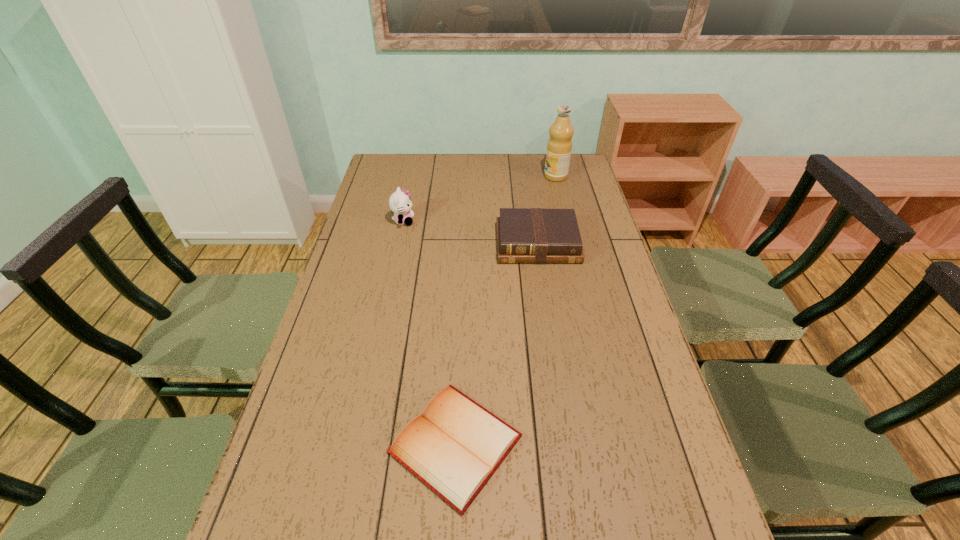
You are a GUI agent. You are given a task and a screenshot of the screen. Output one action in this format:
    pyautogui.click(x=<x>, y=<y>)
    Task: Click on the farthest object
    The height and width of the screenshot is (540, 960).
    Given the screenshot: What is the action you would take?
    pyautogui.click(x=559, y=146)

Locate an element on the screen. olive oil is located at coordinates (559, 146).

You are a GUI agent. You are given a task and a screenshot of the screen. Output one action in this format:
    pyautogui.click(x=<x>, y=<y>)
    Task: Click on the second tallest object
    The height and width of the screenshot is (540, 960).
    Given the screenshot: What is the action you would take?
    pyautogui.click(x=400, y=203)

This screenshot has height=540, width=960. I want to click on kitten, so click(400, 203).

You are a GUI agent. You are given a task and a screenshot of the screen. Output one action in this format:
    pyautogui.click(x=<x>, y=<y>)
    Task: Click on the taller Bible
    This screenshot has height=540, width=960.
    Given the screenshot: What is the action you would take?
    coord(524,235)

The width and height of the screenshot is (960, 540). I want to click on the farther Bible, so click(x=524, y=235).

The height and width of the screenshot is (540, 960). What are the coordinates of `the shorter Bible` in the screenshot? It's located at (456, 445).

Identify the location of the nearer Bible. The height and width of the screenshot is (540, 960). (456, 445).

Identify the location of free location located 0.110m on the label of the olive oil. (517, 177).

Locate an element on the screen. The image size is (960, 540). vacant point located on the label of the olive oil is located at coordinates (466, 177).